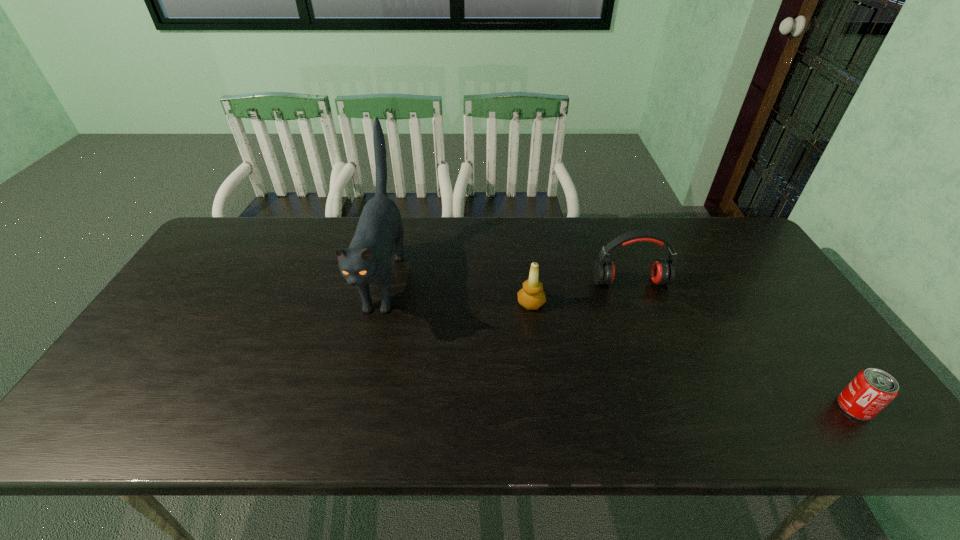
I want to click on vacant area that lies between the leftmost object and the candle_holder, so click(x=457, y=292).

Select which object is the second closest to the leftmost object. Please provide its 2D coordinates. Your answer should be formatted as a tuple, i.e. [(x, y)], where the tuple contains the x and y coordinates of a point satisfying the conditions above.

[(663, 270)]

Choose which object is the third nearest neighbor to the can. Please provide its 2D coordinates. Your answer should be formatted as a tuple, i.e. [(x, y)], where the tuple contains the x and y coordinates of a point satisfying the conditions above.

[(367, 260)]

Locate an element on the screen. The image size is (960, 540). vacant region that satisfies the following two spatial constraints: 1. at the face of the candle_holder; 2. on the right side of the tallest object is located at coordinates (378, 303).

Where is `free space in the image that satisfies the following two spatial constraints: 1. at the face of the third tallest object; 2. on the left side of the cat`? The height and width of the screenshot is (540, 960). free space in the image that satisfies the following two spatial constraints: 1. at the face of the third tallest object; 2. on the left side of the cat is located at coordinates (378, 303).

Locate an element on the screen. vacant space that satisfies the following two spatial constraints: 1. at the face of the shortest object; 2. on the right side of the tallest object is located at coordinates (353, 407).

What are the coordinates of `free region that satisfies the following two spatial constraints: 1. at the face of the cat; 2. on the right side of the second shortest object` in the screenshot? It's located at (378, 303).

Locate an element on the screen. This screenshot has width=960, height=540. blank area in the image that satisfies the following two spatial constraints: 1. at the face of the cat; 2. on the right side of the nearest object is located at coordinates (353, 407).

The width and height of the screenshot is (960, 540). Find the location of `blank area in the image that satisfies the following two spatial constraints: 1. at the face of the tallest object; 2. on the left side of the candle_holder`. blank area in the image that satisfies the following two spatial constraints: 1. at the face of the tallest object; 2. on the left side of the candle_holder is located at coordinates (378, 303).